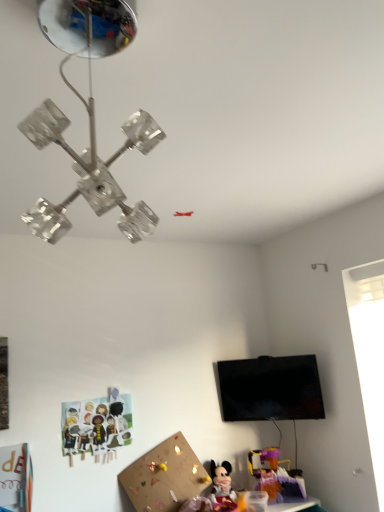
Question: From the image's perspective, is black glossy tv at upper right over plastic purple toy at lower right, the 1th toy positioned from the right?

Choices:
 (A) no
 (B) yes

Answer: (B)

Question: Is plastic purple toy at lower right, the third toy when ordered from left to right, completely or partially inside black glossy tv at upper right?

Choices:
 (A) no
 (B) yes

Answer: (A)

Question: Can you confirm if black glossy tv at upper right is shorter than plastic purple toy at lower right, the 1th toy positioned from the right?

Choices:
 (A) no
 (B) yes

Answer: (A)

Question: Is black glossy tv at upper right outside plastic purple toy at lower right, the third toy when ordered from left to right?

Choices:
 (A) yes
 (B) no

Answer: (A)

Question: From a real-world perspective, does black glossy tv at upper right stand above plastic purple toy at lower right, the third toy when ordered from left to right?

Choices:
 (A) no
 (B) yes

Answer: (B)

Question: Is black glossy tv at upper right taller than plastic purple toy at lower right, the 1th toy positioned from the right?

Choices:
 (A) yes
 (B) no

Answer: (A)

Question: Is clear glass chandelier at upper center aimed at matte plastic minnie mouse at lower center, the second toy positioned from the left?

Choices:
 (A) yes
 (B) no

Answer: (B)

Question: Is matte plastic minnie mouse at lower center, the second toy positioned from the left, at the back of clear glass chandelier at upper center?

Choices:
 (A) no
 (B) yes

Answer: (A)

Question: From the image's perspective, is clear glass chandelier at upper center above matte plastic minnie mouse at lower center, which is the second toy from right to left?

Choices:
 (A) yes
 (B) no

Answer: (A)

Question: Is clear glass chandelier at upper center further to camera compared to matte plastic minnie mouse at lower center, the second toy positioned from the left?

Choices:
 (A) yes
 (B) no

Answer: (B)

Question: Is clear glass chandelier at upper center taller than matte plastic minnie mouse at lower center, which is the second toy from right to left?

Choices:
 (A) yes
 (B) no

Answer: (A)

Question: Is clear glass chandelier at upper center far away from matte plastic minnie mouse at lower center, which is the second toy from right to left?

Choices:
 (A) yes
 (B) no

Answer: (A)

Question: Considering the relative sizes of paper cutout characters at lower left, which is counted as the 1th toy, starting from the left, and plastic purple toy at lower right, the third toy when ordered from left to right, in the image provided, is paper cutout characters at lower left, which is counted as the 1th toy, starting from the left, wider than plastic purple toy at lower right, the third toy when ordered from left to right,?

Choices:
 (A) no
 (B) yes

Answer: (A)